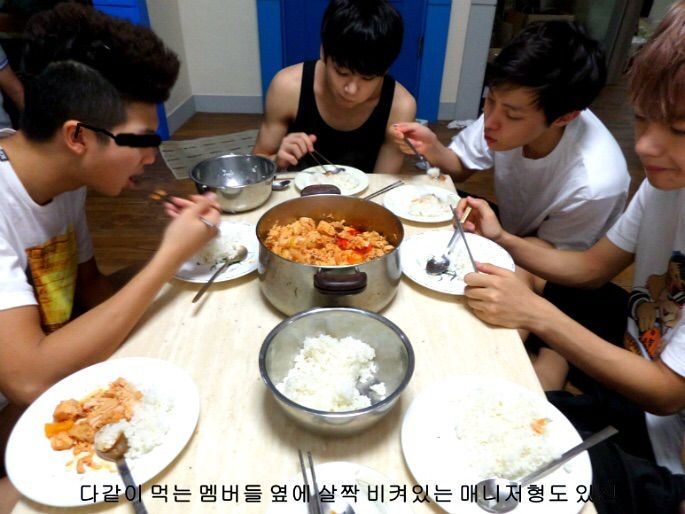
I want to click on chopsticks, so click(312, 473), click(153, 196), click(316, 158), click(386, 188), click(462, 235).